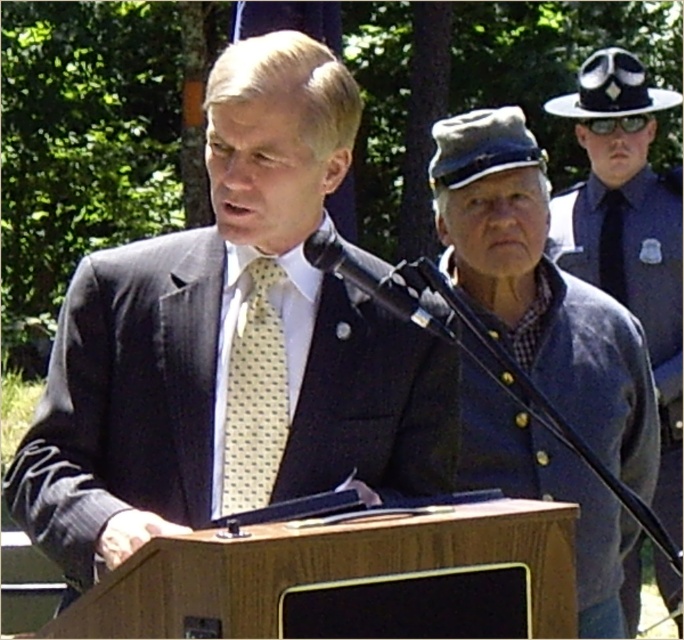
Based on the photo, between blue woolen jacket at right and blue uniformed officer at right, which one has more height?

blue uniformed officer at right is taller.

Is the position of blue woolen jacket at right more distant than that of blue uniformed officer at right?

No, blue woolen jacket at right is closer to the viewer.

Who is more distant from viewer, (x=573, y=300) or (x=586, y=150)?

The point (x=586, y=150) is behind.

Find the location of a particular element. This screenshot has height=640, width=684. blue woolen jacket at right is located at coordinates (540, 289).

Who is more forward, (101,515) or (629,627)?

Point (101,515) is in front.

How much distance is there between matte black suit at center and blue uniformed officer at right?

8.19 feet

Find the location of a particular element. The width and height of the screenshot is (684, 640). matte black suit at center is located at coordinates (231, 344).

Locate an element on the screen. This screenshot has height=640, width=684. matte black suit at center is located at coordinates (231, 344).

Between blue woolen jacket at right and yellow dotted tie at center, which one is positioned higher?

Positioned higher is yellow dotted tie at center.

Is blue woolen jacket at right closer to camera compared to yellow dotted tie at center?

No, blue woolen jacket at right is further to the viewer.

Is point (473, 436) less distant than point (235, 442)?

No, it is not.

The height and width of the screenshot is (640, 684). In order to click on blue woolen jacket at right in this screenshot , I will do `click(540, 289)`.